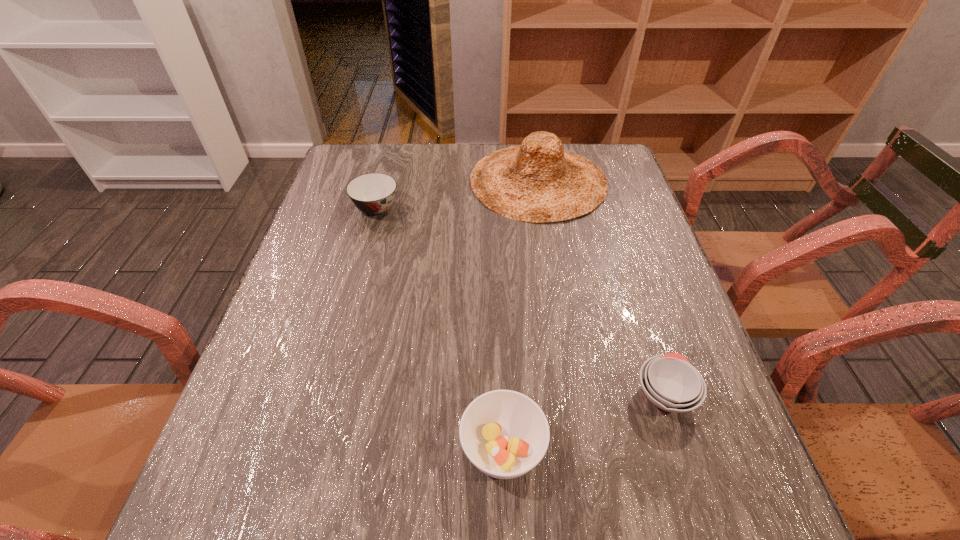
I want to click on vacant position at the far left corner of the desktop, so click(334, 173).

Where is `free space at the far right corner of the desktop`? The width and height of the screenshot is (960, 540). free space at the far right corner of the desktop is located at coordinates coord(572,152).

Image resolution: width=960 pixels, height=540 pixels. Identify the location of vacant point at the near right corner. (660, 500).

This screenshot has height=540, width=960. I want to click on vacant region between the sunhat and the farthest soup bowl, so click(457, 195).

Locate an element on the screen. blank region between the farthest soup bowl and the second soup bowl from right to left is located at coordinates (440, 329).

What are the coordinates of `vacant space that is in between the second soup bowl from left to right and the shortest soup bowl` in the screenshot? It's located at (584, 421).

Where is `free spot between the shortest soup bowl and the second soup bowl from left to right`? The width and height of the screenshot is (960, 540). free spot between the shortest soup bowl and the second soup bowl from left to right is located at coordinates (584, 421).

Where is `empty location between the shortest soup bowl and the sunhat`? empty location between the shortest soup bowl and the sunhat is located at coordinates pyautogui.click(x=601, y=287).

You are a GUI agent. You are given a task and a screenshot of the screen. Output one action in this format:
    pyautogui.click(x=<x>, y=<y>)
    Task: Click on the vacant point located between the second soup bowl from right to left and the sunhat
    
    Given the screenshot: What is the action you would take?
    pyautogui.click(x=520, y=315)

Where is `free space between the leftmost soup bowl and the sunhat`? Image resolution: width=960 pixels, height=540 pixels. free space between the leftmost soup bowl and the sunhat is located at coordinates (457, 195).